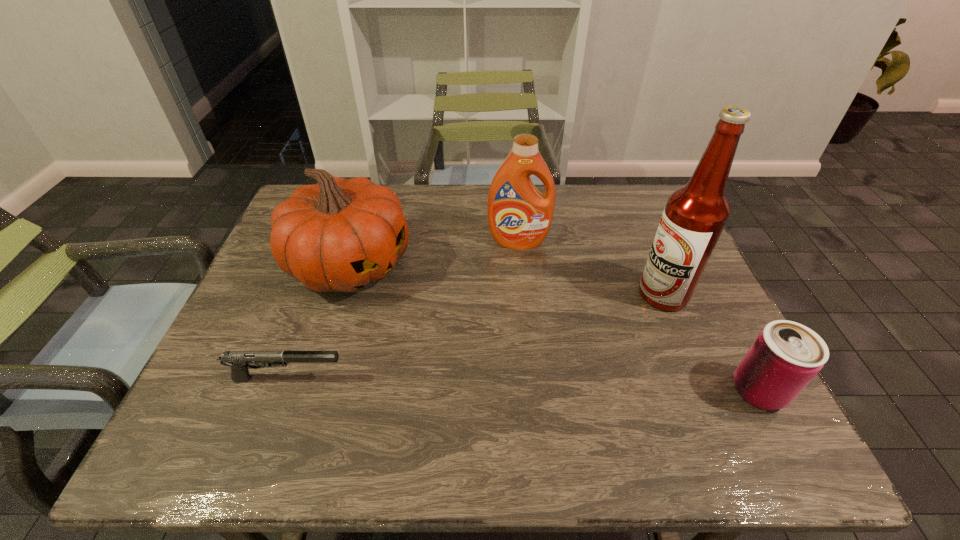
At what (x,y) coordinates should I click in order to perform the action: click on free space on the desktop that is between the shortest object and the fourth tallest object and is positioned on the face of the third shortest object. Please return your answer as a coordinate pair (x, y). The width and height of the screenshot is (960, 540). Looking at the image, I should click on (553, 385).

You are a GUI agent. You are given a task and a screenshot of the screen. Output one action in this format:
    pyautogui.click(x=<x>, y=<y>)
    Task: Click on the free space on the desktop that is between the shortest object and the can and is positioned on the label side of the alcohol
    This screenshot has height=540, width=960.
    Given the screenshot: What is the action you would take?
    pyautogui.click(x=522, y=384)

Find the location of a particular element. The image size is (960, 540). free space on the desktop that is between the shortest object and the can and is positioned on the front-facing side of the fourth shortest object is located at coordinates (530, 384).